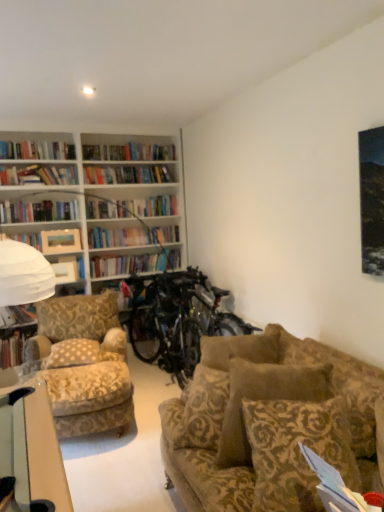
Question: Does metallic silver bicycle at center appear on the right side of matte wooden picture frame at upper left, which ranks as the 1th picture frame in top-to-bottom order?

Choices:
 (A) no
 (B) yes

Answer: (B)

Question: Are metallic silver bicycle at center and matte wooden picture frame at upper left, which appears as the 2th picture frame when ordered from the bottom, far apart?

Choices:
 (A) yes
 (B) no

Answer: (A)

Question: Is metallic silver bicycle at center with matte wooden picture frame at upper left, which appears as the 2th picture frame when ordered from the bottom?

Choices:
 (A) no
 (B) yes

Answer: (A)

Question: From a real-world perspective, is metallic silver bicycle at center located beneath matte wooden picture frame at upper left, which ranks as the 1th picture frame in top-to-bottom order?

Choices:
 (A) no
 (B) yes

Answer: (B)

Question: Considering the relative sizes of metallic silver bicycle at center and matte wooden picture frame at upper left, which appears as the 2th picture frame when ordered from the bottom, in the image provided, is metallic silver bicycle at center wider than matte wooden picture frame at upper left, which appears as the 2th picture frame when ordered from the bottom,?

Choices:
 (A) no
 (B) yes

Answer: (B)

Question: From a real-world perspective, is matte white picture frame at upper left, the 2th picture frame from the top, above or below matte wooden picture frame at upper left, which ranks as the 1th picture frame in top-to-bottom order?

Choices:
 (A) below
 (B) above

Answer: (A)

Question: Is matte white picture frame at upper left, acting as the 1th picture frame starting from the bottom, bigger or smaller than matte wooden picture frame at upper left, which ranks as the 1th picture frame in top-to-bottom order?

Choices:
 (A) small
 (B) big

Answer: (A)

Question: From their relative heights in the image, would you say matte white picture frame at upper left, acting as the 1th picture frame starting from the bottom, is taller or shorter than matte wooden picture frame at upper left, which ranks as the 1th picture frame in top-to-bottom order?

Choices:
 (A) short
 (B) tall

Answer: (A)

Question: Do you think matte white picture frame at upper left, acting as the 1th picture frame starting from the bottom, is within matte wooden picture frame at upper left, which appears as the 2th picture frame when ordered from the bottom, or outside of it?

Choices:
 (A) inside
 (B) outside

Answer: (B)

Question: From their relative heights in the image, would you say suede-patterned couch at center is taller or shorter than hardcover book at left, positioned as the 1th book in bottom-to-top order?

Choices:
 (A) tall
 (B) short

Answer: (A)

Question: Is suede-patterned couch at center wider or thinner than hardcover book at left, the second book when ordered from top to bottom?

Choices:
 (A) thin
 (B) wide

Answer: (B)

Question: Is suede-patterned couch at center to the left or to the right of hardcover book at left, positioned as the 1th book in bottom-to-top order, in the image?

Choices:
 (A) right
 (B) left

Answer: (A)

Question: In terms of size, does suede-patterned couch at center appear bigger or smaller than hardcover book at left, the second book when ordered from top to bottom?

Choices:
 (A) big
 (B) small

Answer: (A)

Question: Which is correct: suede-patterned couch at center is inside white paper at lower right, or outside of it?

Choices:
 (A) outside
 (B) inside

Answer: (A)

Question: Is point (339, 468) positioned closer to the camera than point (322, 493)?

Choices:
 (A) farther
 (B) closer

Answer: (A)